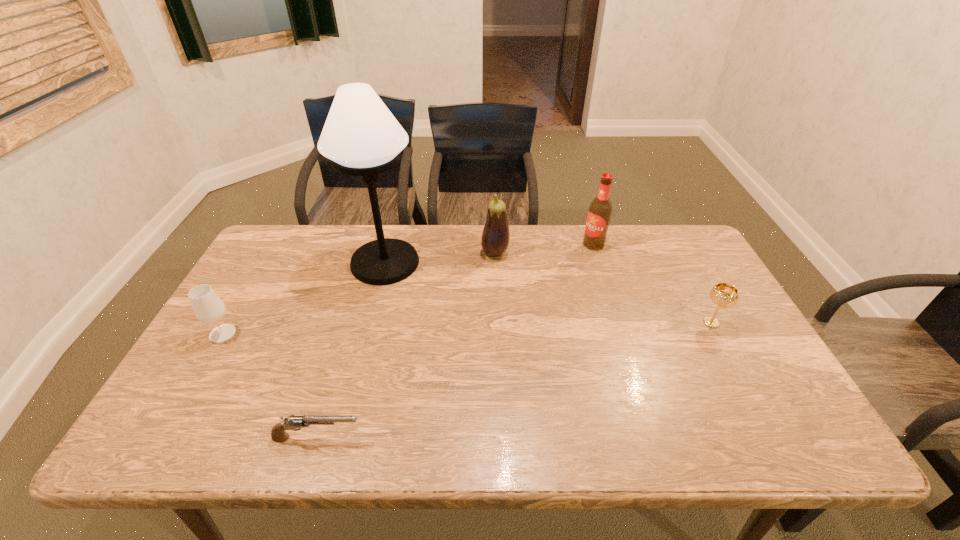
Locate an element on the screen. free location located on the right of the fifth object from left to right is located at coordinates (656, 244).

Identify the location of vacant region located on the left of the eggplant. The width and height of the screenshot is (960, 540). (401, 253).

What are the coordinates of `vacant space situated on the right of the glass` in the screenshot? It's located at (258, 333).

Image resolution: width=960 pixels, height=540 pixels. I want to click on vacant space located on the front of the rightmost object, so click(x=774, y=440).

You are a GUI agent. You are given a task and a screenshot of the screen. Output one action in this format:
    pyautogui.click(x=<x>, y=<y>)
    Task: Click on the free spot located 0.140m aiming along the barrel of the gun
    This screenshot has height=540, width=960.
    Given the screenshot: What is the action you would take?
    pyautogui.click(x=427, y=438)

This screenshot has width=960, height=540. I want to click on table lamp that is at the far edge, so click(x=361, y=137).

Find the location of `beer bottle that is at the far edge`. beer bottle that is at the far edge is located at coordinates (599, 214).

Locate an element on the screen. This screenshot has width=960, height=540. eggplant that is positioned at the far edge is located at coordinates (495, 237).

Locate an element on the screen. The image size is (960, 540). object present at the near edge is located at coordinates (278, 434).

At what (x,y) coordinates should I click in order to perform the action: click on object located at the left edge. Please return your answer as a coordinate pair (x, y). The width and height of the screenshot is (960, 540). Looking at the image, I should click on (208, 308).